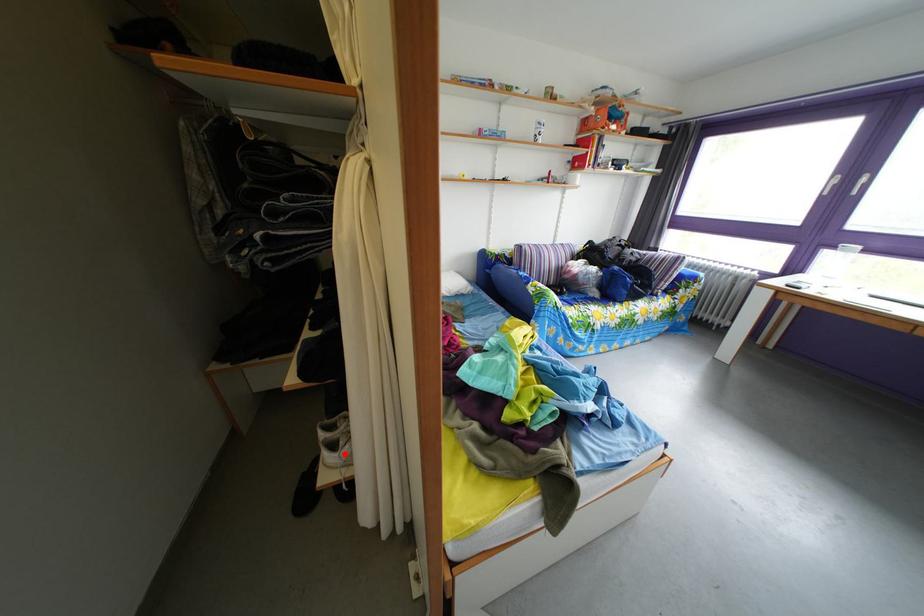
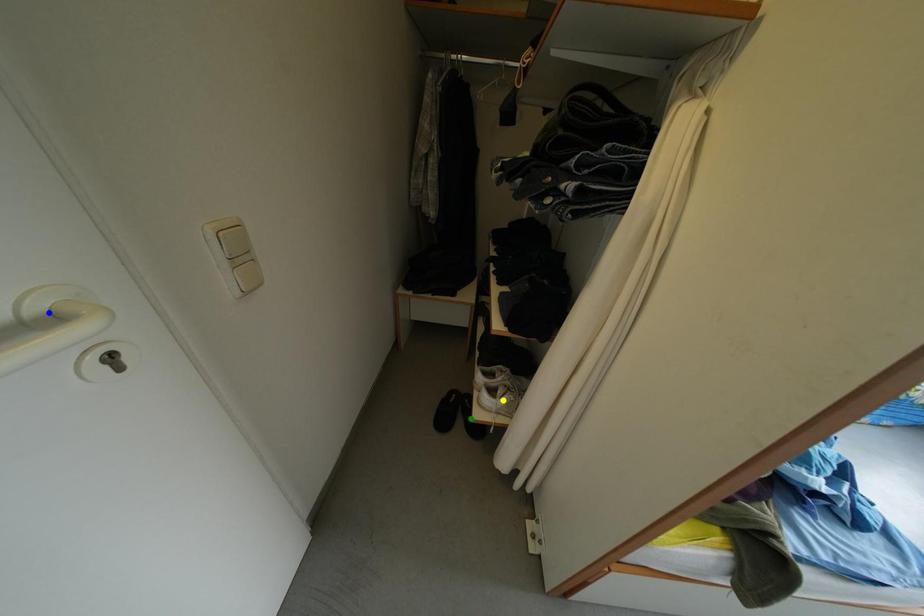
Question: I am providing you with two images of the same scene from different viewpoints. A red point is marked on the first image. You are given multiple points on the second image. Which mark in image 2 goes with the point in image 1?

Choices:
 (A) blue point
 (B) green point
 (C) yellow point

Answer: (C)